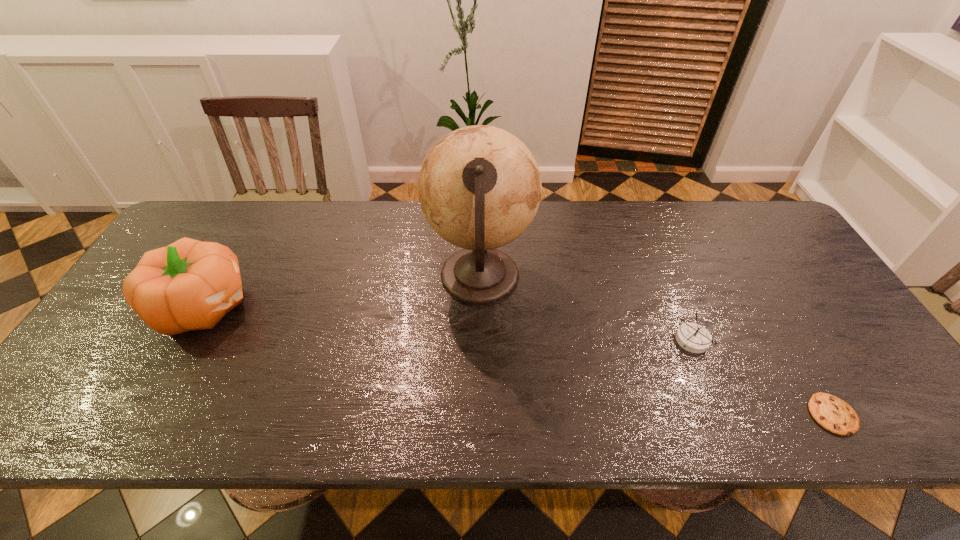
The height and width of the screenshot is (540, 960). What are the coordinates of `vacant space that satisfies the following two spatial constraints: 1. on the front-facing side of the third object from right to left; 2. on the right side of the third tallest object` in the screenshot? It's located at (480, 341).

Find the location of `free space that satisfies the following two spatial constraints: 1. on the front-facing side of the rightmost object; 2. on the left side of the tallest object`. free space that satisfies the following two spatial constraints: 1. on the front-facing side of the rightmost object; 2. on the left side of the tallest object is located at coordinates (480, 414).

The width and height of the screenshot is (960, 540). In order to click on blank space that satisfies the following two spatial constraints: 1. on the back side of the compass; 2. on the carved face of the leftmost object in this screenshot , I will do `click(679, 306)`.

This screenshot has height=540, width=960. I want to click on free space that satisfies the following two spatial constraints: 1. on the front-facing side of the tallest object; 2. on the back side of the rightmost object, so click(x=480, y=414).

The image size is (960, 540). What are the coordinates of `free space that satisfies the following two spatial constraints: 1. on the front-facing side of the tallest object; 2. on the back side of the third object from left to right` in the screenshot? It's located at click(480, 341).

Image resolution: width=960 pixels, height=540 pixels. In order to click on vacant point that satisfies the following two spatial constraints: 1. on the front-facing side of the globe; 2. on the right side of the compass in this screenshot , I will do `click(480, 341)`.

Find the location of `vacant space that satisfies the following two spatial constraints: 1. on the front-facing side of the third object from left to right; 2. on the right side of the tallest object`. vacant space that satisfies the following two spatial constraints: 1. on the front-facing side of the third object from left to right; 2. on the right side of the tallest object is located at coordinates (480, 341).